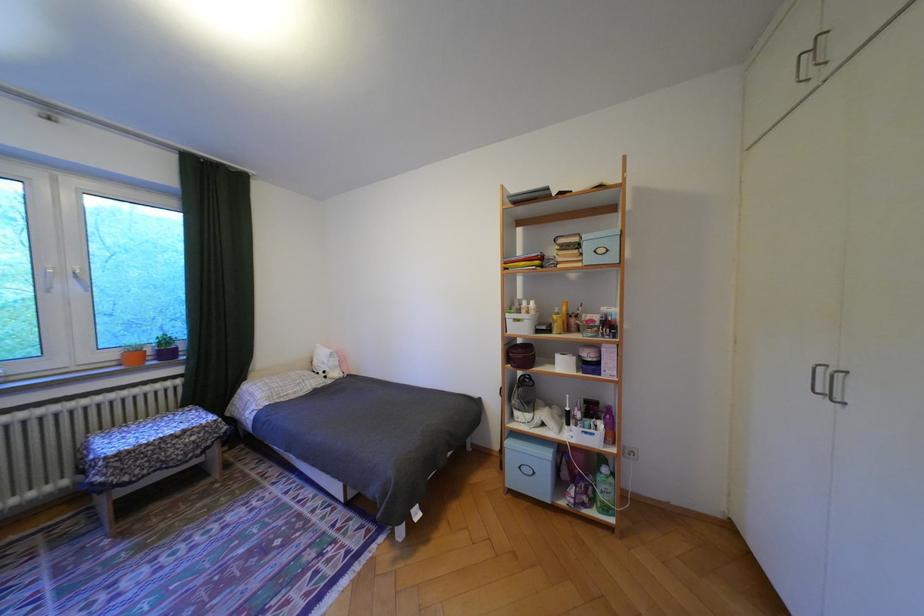
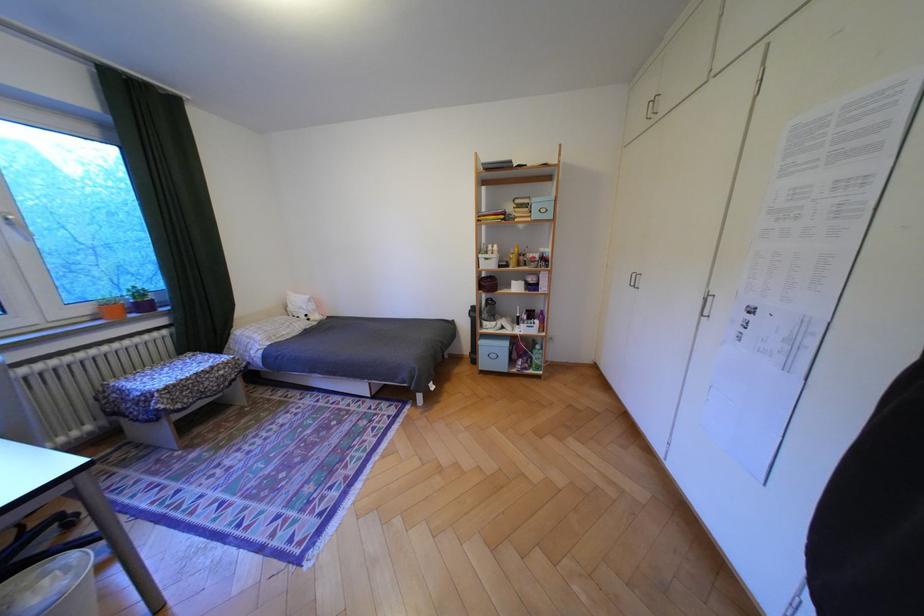
Where in the second image is the point corresponding to point (124, 355) from the first image?

(99, 310)